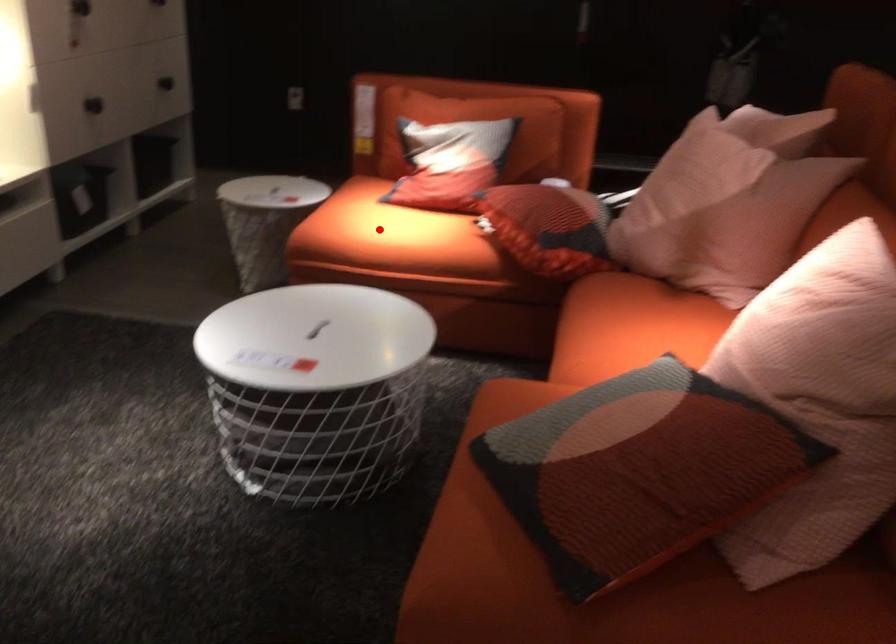
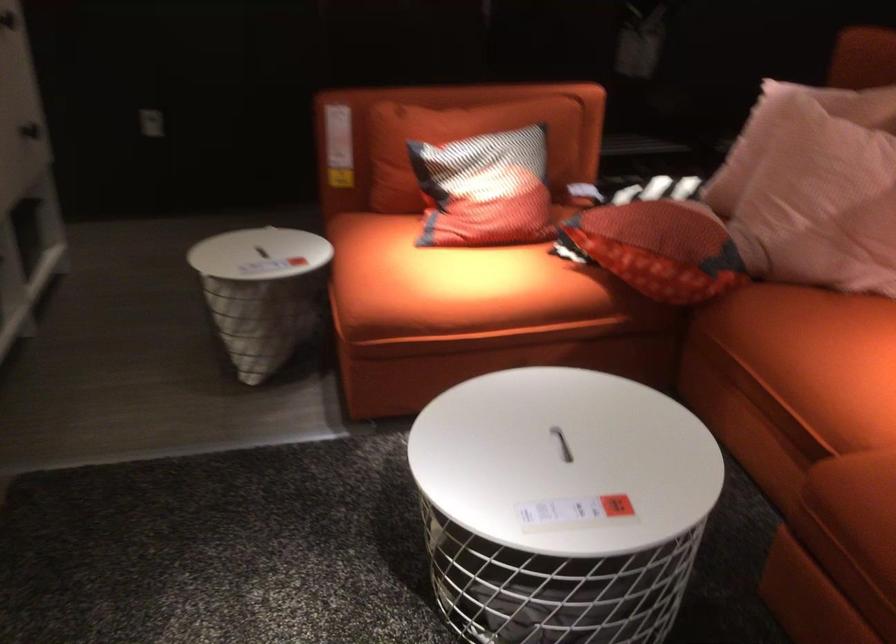
Question: I am providing you with two images of the same scene from different viewpoints. Image1 has a red point marked. In image2, the corresponding 3D location appears at what relative position? Reply with the corresponding letter.

Choices:
 (A) Closer
 (B) Farther

Answer: (A)